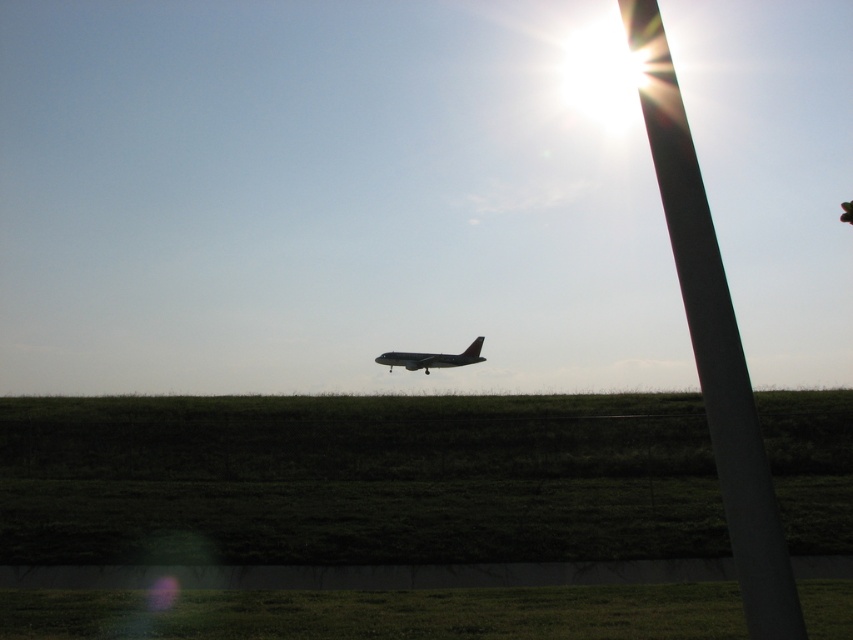
You are a photographer trying to capture the metallic gray airplane at center without the white smooth pole at upper right blocking the view. Is the pole too large to avoid in the frame?

The white smooth pole at upper right has a larger size compared to metallic gray airplane at center, so it might block the view of the metallic gray airplane at center depending on the camera angle and distance.

You are a photographer trying to capture the metallic gray airplane at center without the white smooth pole at upper right blocking the view. Can you adjust your position to avoid the pole?

The white smooth pole at upper right is much taller than the metallic gray airplane at center, so adjusting your position might not be sufficient to avoid the pole blocking the view. Consider moving to a lower angle or position where the pole is out of frame.

Based on the scene description, can you determine if the white smooth pole at upper right is wider than the metallic gray airplane at center?

The white smooth pole at upper right is wider than the metallic gray airplane at center according to the description.